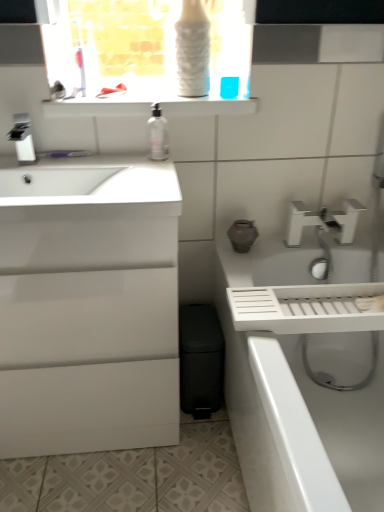
Question: Choose the correct answer: Is white glossy bath at right inside satin nickel faucet at upper left, placed as the second tap when sorted from right to left, or outside it?

Choices:
 (A) outside
 (B) inside

Answer: (A)

Question: From a real-world perspective, is white glossy bath at right positioned above or below satin nickel faucet at upper left, arranged as the 1th tap when viewed from the front?

Choices:
 (A) above
 (B) below

Answer: (B)

Question: Estimate the real-world distances between objects in this image. Which object is farther from the white glossy faucet at upper right, positioned as the 2th tap in left-to-right order?

Choices:
 (A) white glossy cabinet at left
 (B) white glossy bath at right
 (C) white glossy shelf at upper center
 (D) satin nickel faucet at upper left, placed as the second tap when sorted from right to left
 (E) clear plastic bottle at center

Answer: (D)

Question: Based on their relative distances, which object is farther from the satin nickel faucet at upper left, marked as the first tap in a top-to-bottom arrangement?

Choices:
 (A) white glossy cabinet at left
 (B) white glossy shelf at upper center
 (C) clear plastic bottle at center
 (D) white glossy faucet at upper right, the 2th tap positioned from the top
 (E) white glossy bath at right

Answer: (D)